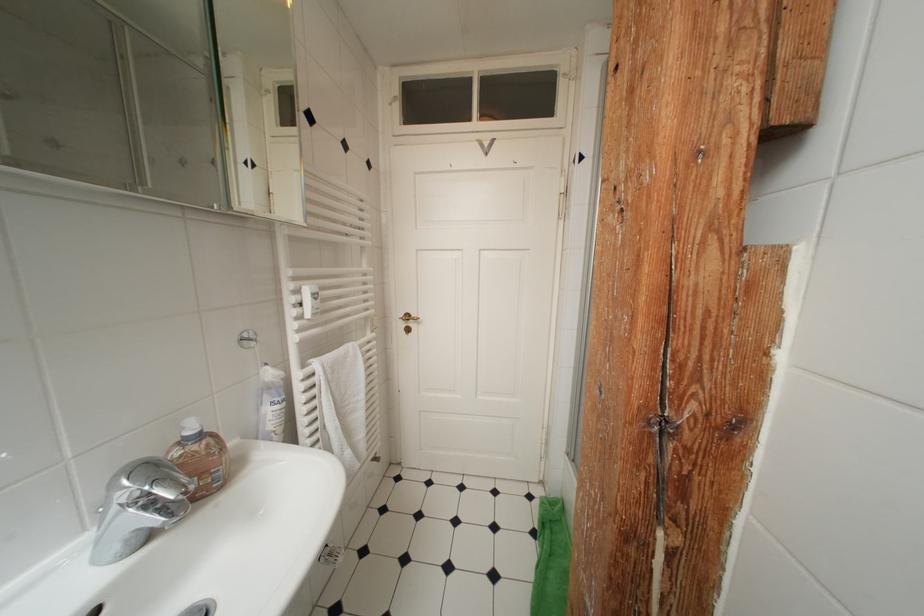
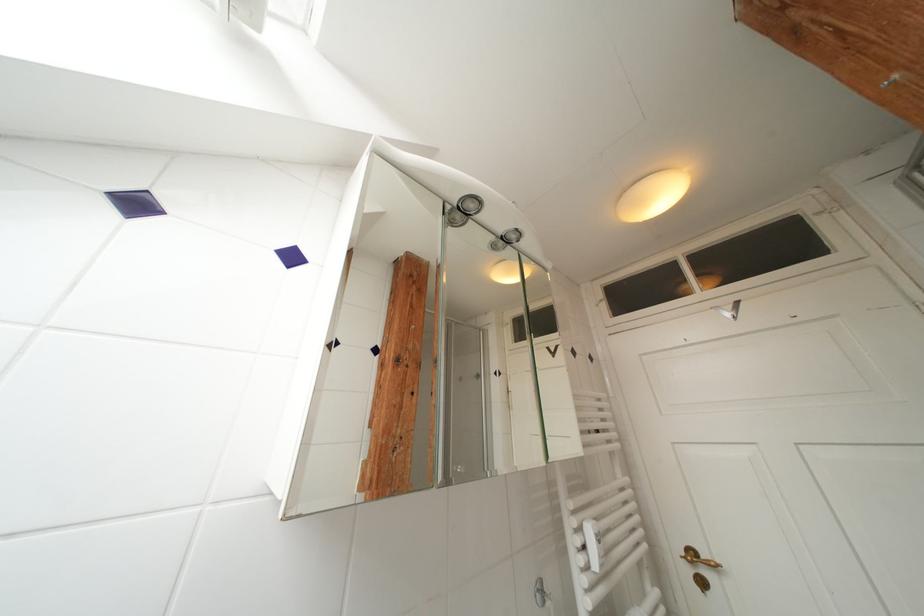
Where in the second image is the point corresponding to point (253, 167) from the first image?

(502, 377)